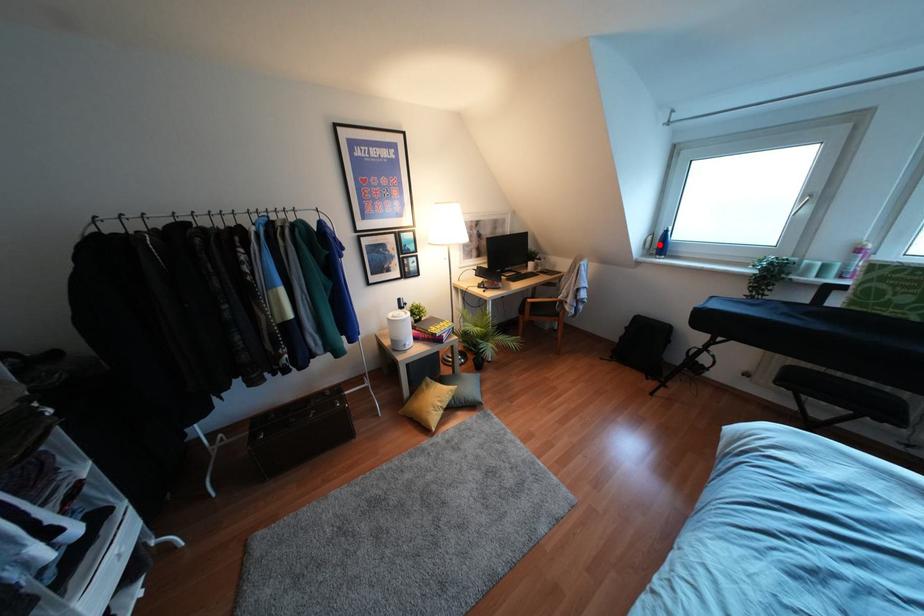
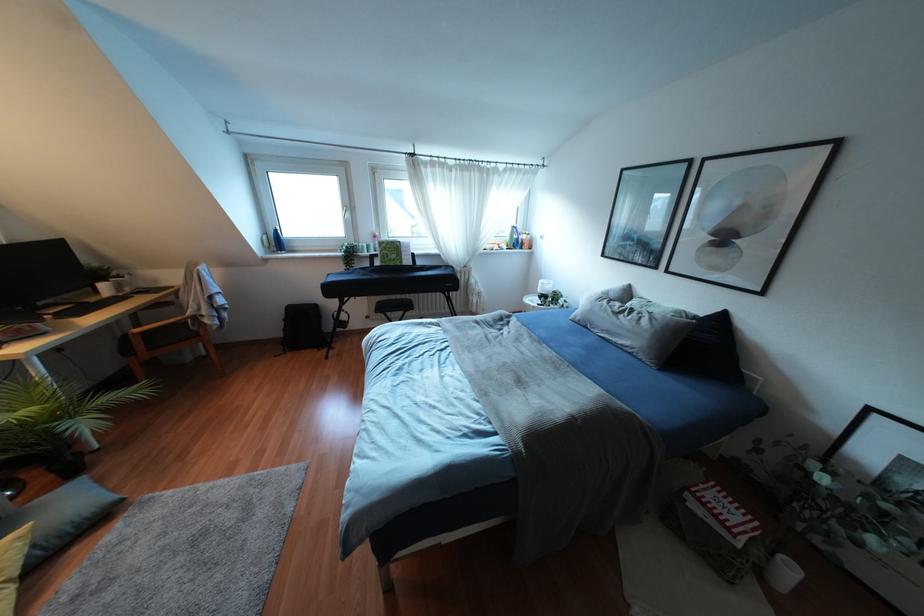
In the second image, find the point that corresponds to the highlighted location in the first image.

(275, 241)